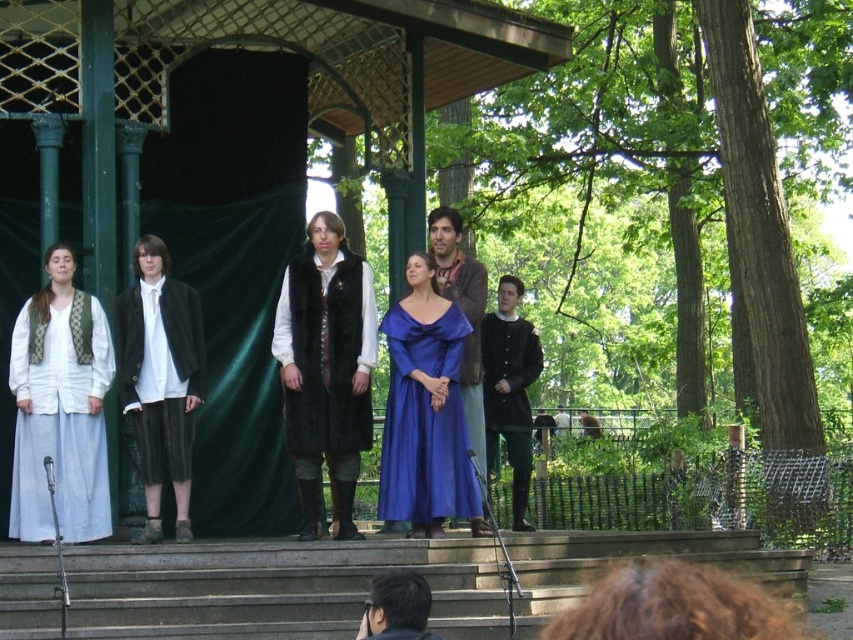
Which is more to the left, concrete stairs at lower center or matte black coat at center?

matte black coat at center

Does concrete stairs at lower center lie in front of matte black coat at center?

Yes.

Identify the location of concrete stairs at lower center. (274, 588).

Does white woven fabric dress at left have a lesser width compared to dark green woolen tunic at center?

No.

Does white woven fabric dress at left appear on the right side of dark green woolen tunic at center?

No, white woven fabric dress at left is not to the right of dark green woolen tunic at center.

This screenshot has height=640, width=853. What do you see at coordinates (61, 408) in the screenshot?
I see `white woven fabric dress at left` at bounding box center [61, 408].

Identify the location of white woven fabric dress at left. [x=61, y=408].

Does white woven fabric dress at left lie in front of velvet brown coat at center?

Yes, it is in front of velvet brown coat at center.

Does white woven fabric dress at left have a lesser height compared to velvet brown coat at center?

Indeed, white woven fabric dress at left has a lesser height compared to velvet brown coat at center.

Which is in front, point (91, 493) or point (480, 262)?

Positioned in front is point (91, 493).

Locate an element on the screen. The height and width of the screenshot is (640, 853). white woven fabric dress at left is located at coordinates (61, 408).